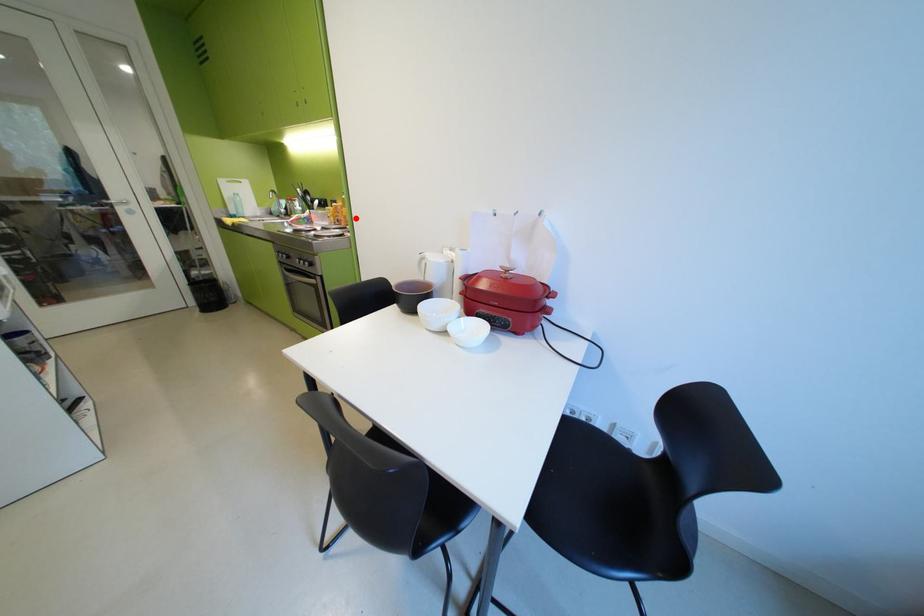
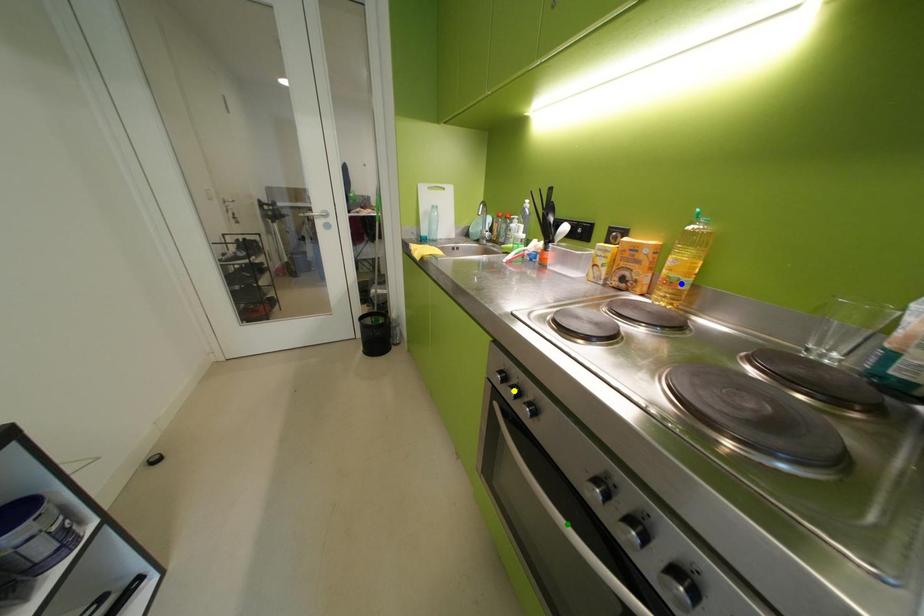
Question: I am providing you with two images of the same scene from different viewpoints. A red point is marked on the first image. You are given multiple points on the second image. Which point in image 2 represents the same 3d spot as the red point in image 1?

Choices:
 (A) green point
 (B) blue point
 (C) yellow point

Answer: (B)